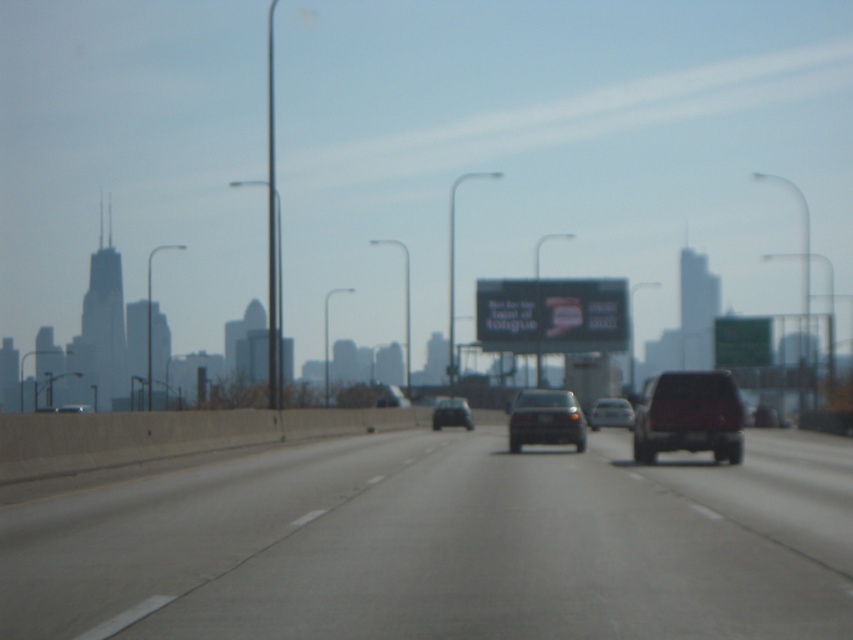
You are a delivery driver who needs to park your truck next to the dark red matte suv at right and the black plastic license plate at center. Since the truck is 2 meters wide, will it fit between them?

The dark red matte suv at right is bigger than the black plastic license plate at center, but the size comparison doesn not provide information about the distance between them. Without knowing the actual distance between the two objects, it is impossible to determine if the truck will fit.

You are a parking attendant and need to park a car in a spot that is exactly the width of the black plastic license plate at center. Can the shiny black sedan at center fit into this spot without touching the sides?

The shiny black sedan at center might be wider than the black plastic license plate at center, so it may not fit into the parking spot without touching the sides.